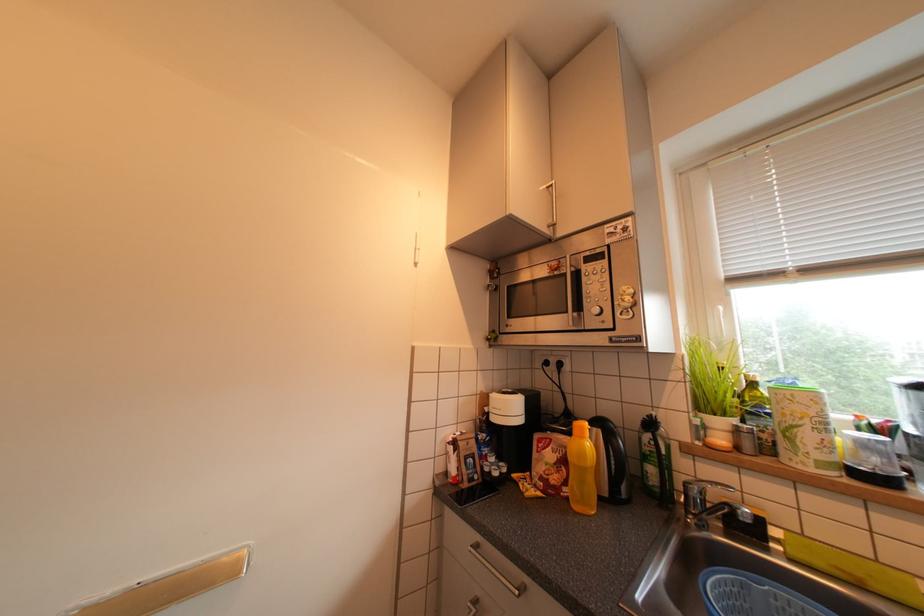
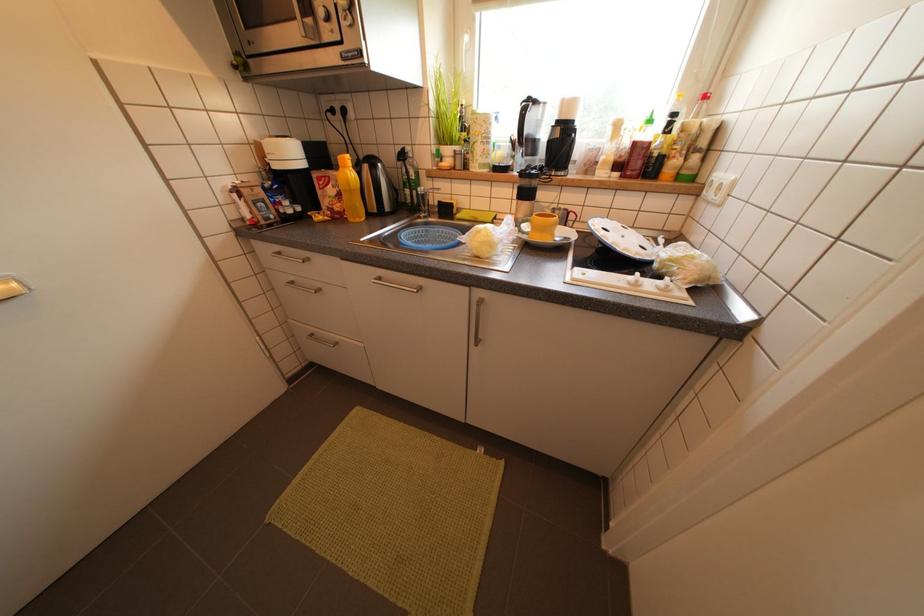
The first image is from the beginning of the video and the second image is from the end. How did the camera likely rotate when shooting the video?

The camera's rotation is toward right-down.